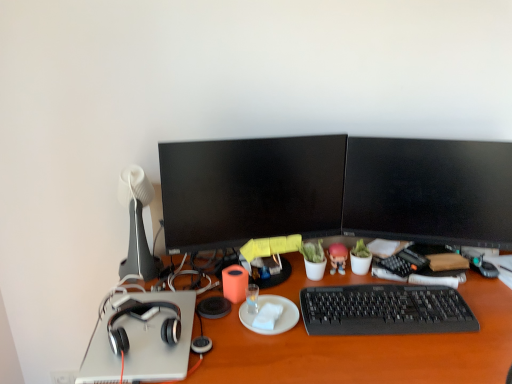
Find the location of `empty space that is ontop of black matte headphones at left (from a real-world perspective)`. empty space that is ontop of black matte headphones at left (from a real-world perspective) is located at coordinates (346, 315).